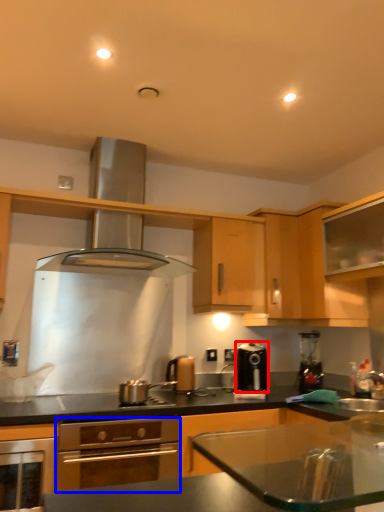
Question: Among these objects, which one is farthest to the camera, kitchen appliance (highlighted by a red box) or kitchen appliance (highlighted by a blue box)?

Choices:
 (A) kitchen appliance
 (B) kitchen appliance

Answer: (A)